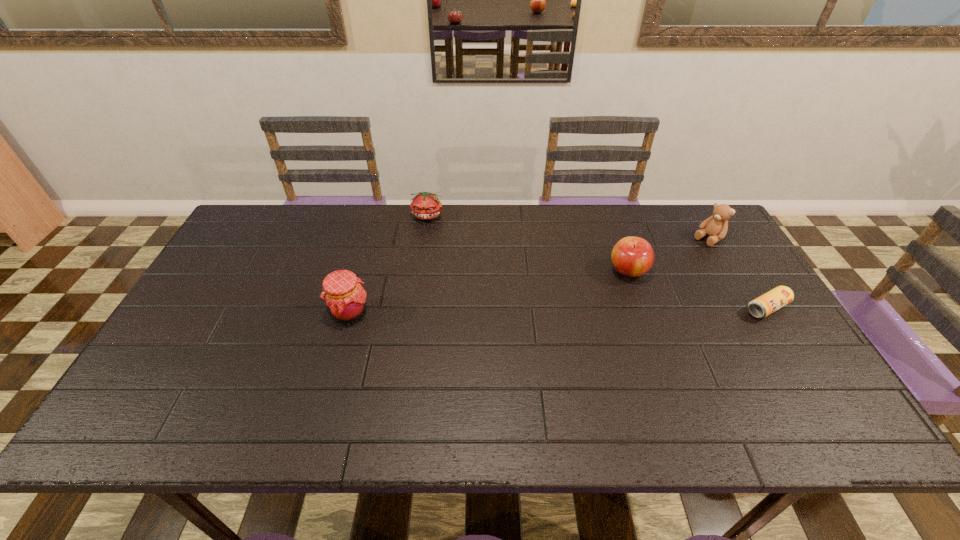
I want to click on beer can that is at the right edge, so click(x=766, y=304).

Find the location of a particular element. Image resolution: width=960 pixels, height=540 pixels. teddy bear situated at the right edge is located at coordinates (716, 226).

Where is `object that is at the far right corner`? Image resolution: width=960 pixels, height=540 pixels. object that is at the far right corner is located at coordinates (716, 226).

In order to click on vacant area at the far edge in this screenshot , I will do `click(617, 225)`.

In the image, there is a desktop. Identify the location of vacant region at the near edge. The height and width of the screenshot is (540, 960). (559, 378).

Where is `free spot at the left edge of the desktop`? This screenshot has width=960, height=540. free spot at the left edge of the desktop is located at coordinates (270, 249).

This screenshot has width=960, height=540. In order to click on vacant space at the right edge of the desktop in this screenshot , I will do `click(718, 254)`.

In the image, there is a desktop. Where is `vacant space at the far left corner`? vacant space at the far left corner is located at coordinates (269, 215).

Where is `vacant space at the near left corner of the desktop`? vacant space at the near left corner of the desktop is located at coordinates [148, 382].

This screenshot has width=960, height=540. In the image, there is a desktop. Identify the location of free space at the far right corner. (665, 206).